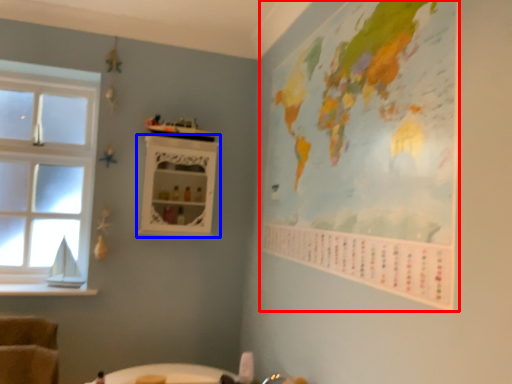
Question: Which object appears farthest to the camera in this image, map (highlighted by a red box) or shelf (highlighted by a blue box)?

Choices:
 (A) map
 (B) shelf

Answer: (B)